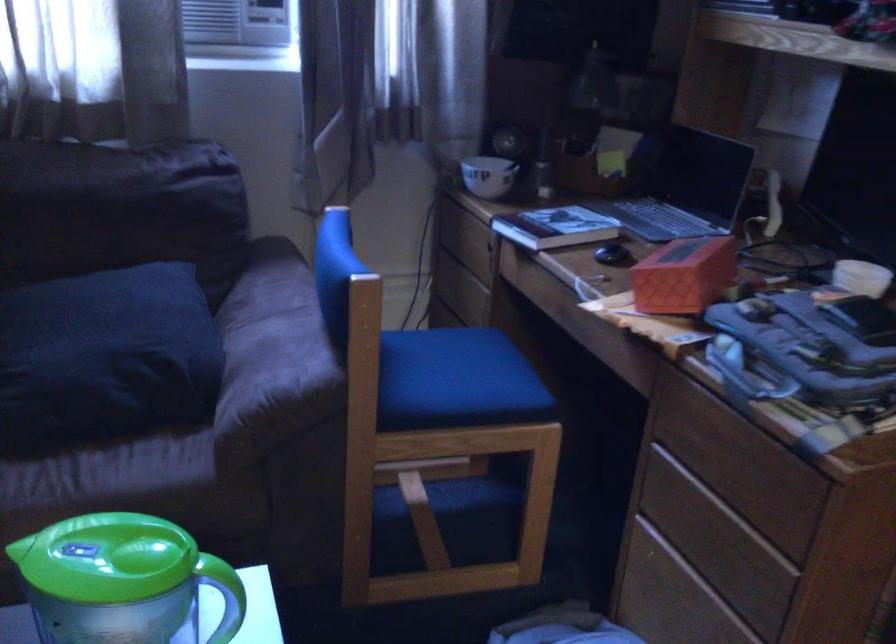
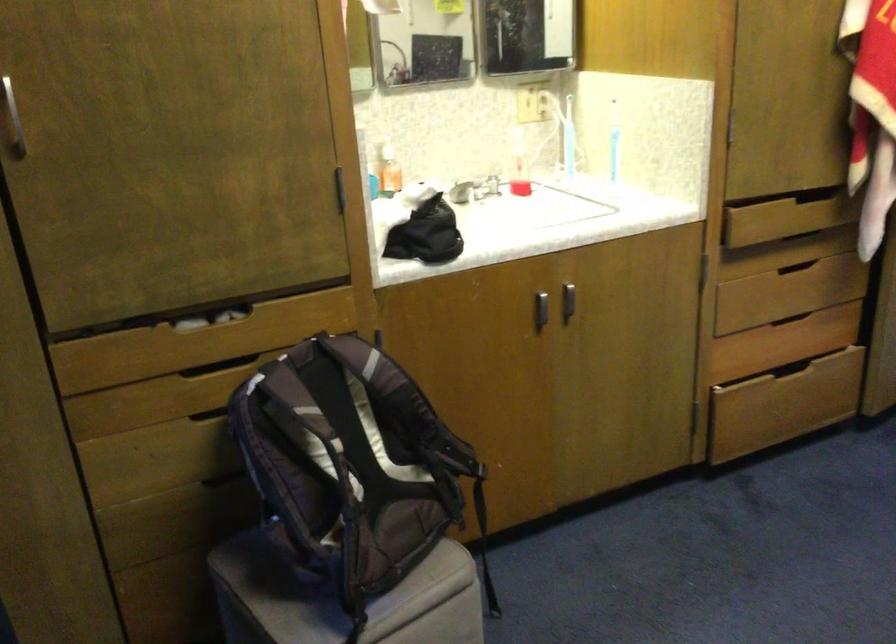
First-person continuous shooting, in which direction is the camera rotating?

The rotation direction of the camera is right-down.